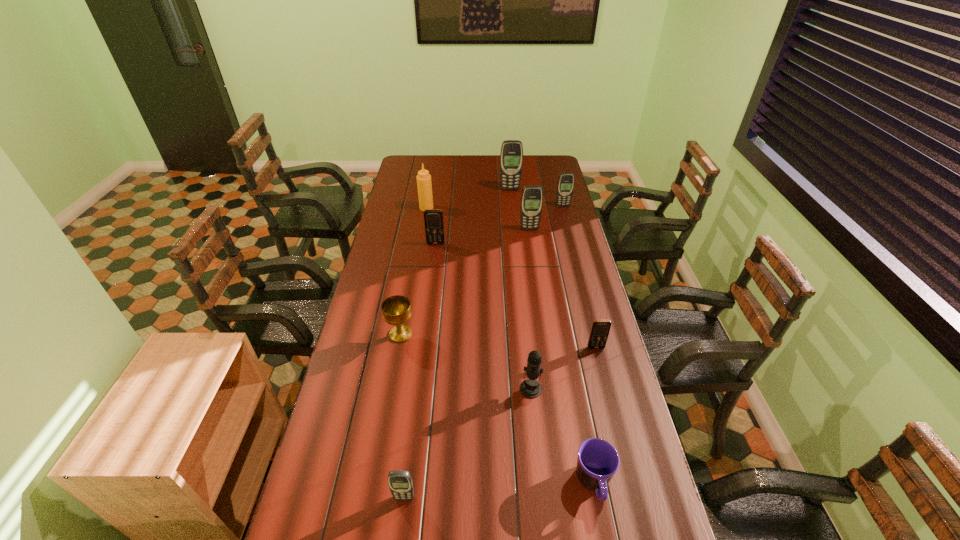
Where is `the farthest cellular telephone`? This screenshot has width=960, height=540. the farthest cellular telephone is located at coordinates (511, 156).

Locate an element on the screen. This screenshot has width=960, height=540. the tallest cellular telephone is located at coordinates (511, 156).

The image size is (960, 540). I want to click on condiment, so click(424, 184).

I want to click on the fourth farthest object, so click(x=532, y=196).

Find the location of a particular element. The image size is (960, 540). the third smallest gray cellular telephone is located at coordinates (532, 196).

Find the location of a particular element. This screenshot has height=540, width=960. the second smallest gray cellular telephone is located at coordinates (565, 187).

I want to click on the rightmost gray cellular telephone, so click(565, 187).

Image resolution: width=960 pixels, height=540 pixels. What are the coordinates of `the left orange cellular telephone` in the screenshot? It's located at (433, 218).

What are the coordinates of `the sixth nearest object` in the screenshot? It's located at (433, 218).

Locate an element on the screen. microphone is located at coordinates (530, 388).